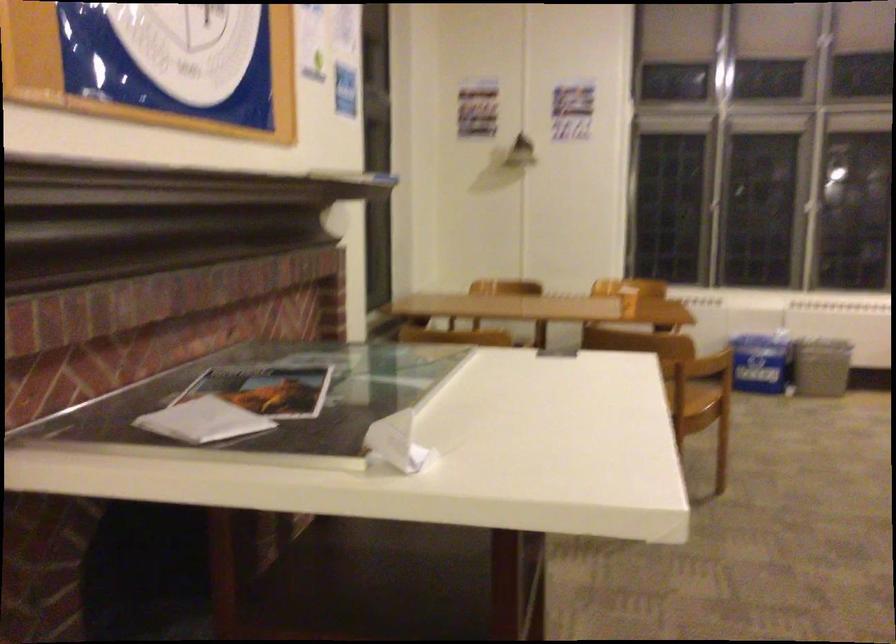
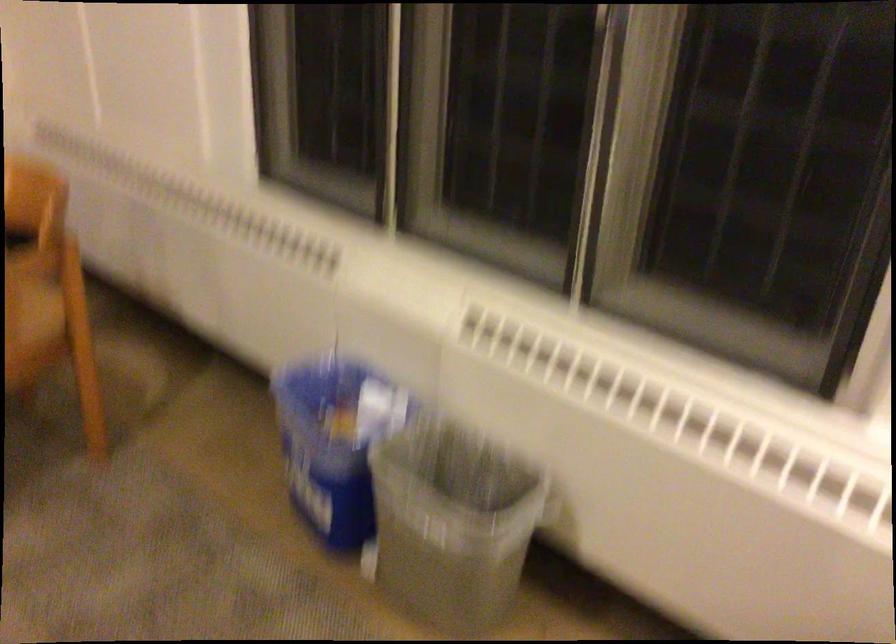
Locate, in the second image, the point that corresponds to the point at 771,315 in the first image.

(334, 442)